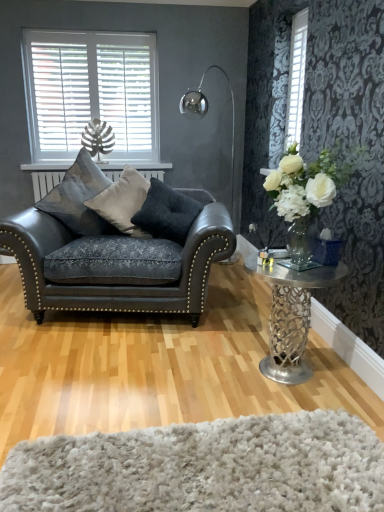
Question: Is metallic silver table at right wider or thinner than polished metal floor lamp at upper center?

Choices:
 (A) thin
 (B) wide

Answer: (A)

Question: Considering their positions, is metallic silver table at right located in front of or behind polished metal floor lamp at upper center?

Choices:
 (A) front
 (B) behind

Answer: (A)

Question: Estimate the real-world distances between objects in this image. Which object is closer to the polished metal floor lamp at upper center?

Choices:
 (A) white textured blinds at upper right, which appears as the second window when viewed from the left
 (B) white wood blinds at upper left, arranged as the 2th window when viewed from the right
 (C) suede-like gray pillow at center, the 2th pillow in the right-to-left sequence
 (D) metallic silver table at right
 (E) dark gray fabric pillow at center, the first pillow in the right-to-left sequence

Answer: (A)

Question: Which object is positioned closest to the metallic silver table at right?

Choices:
 (A) white wood blinds at upper left, which ranks as the 1th window in left-to-right order
 (B) white textured blinds at upper right, which appears as the second window when viewed from the left
 (C) satin blue cushion at left, arranged as the first pillow when viewed from the left
 (D) polished metal floor lamp at upper center
 (E) white shaggy rug at lower center

Answer: (E)